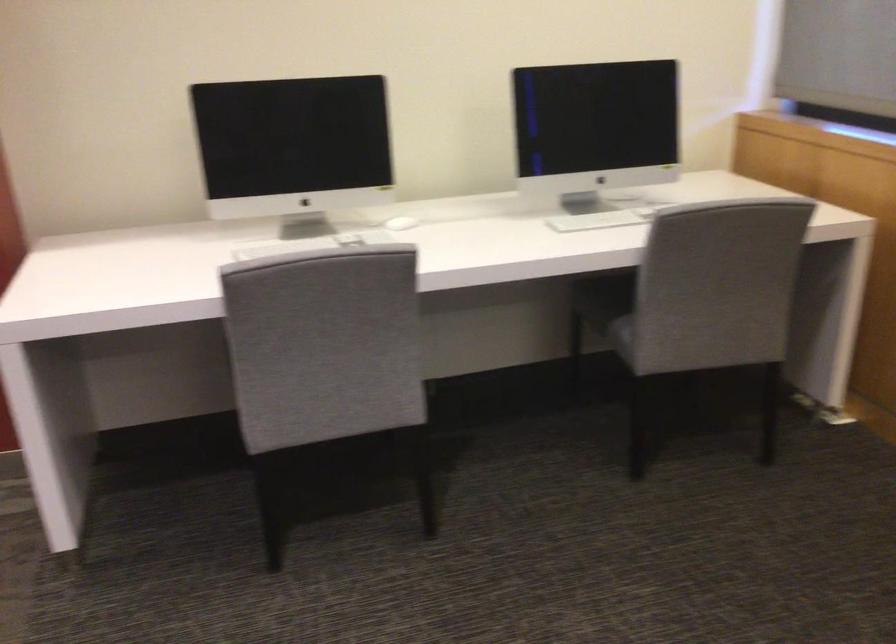
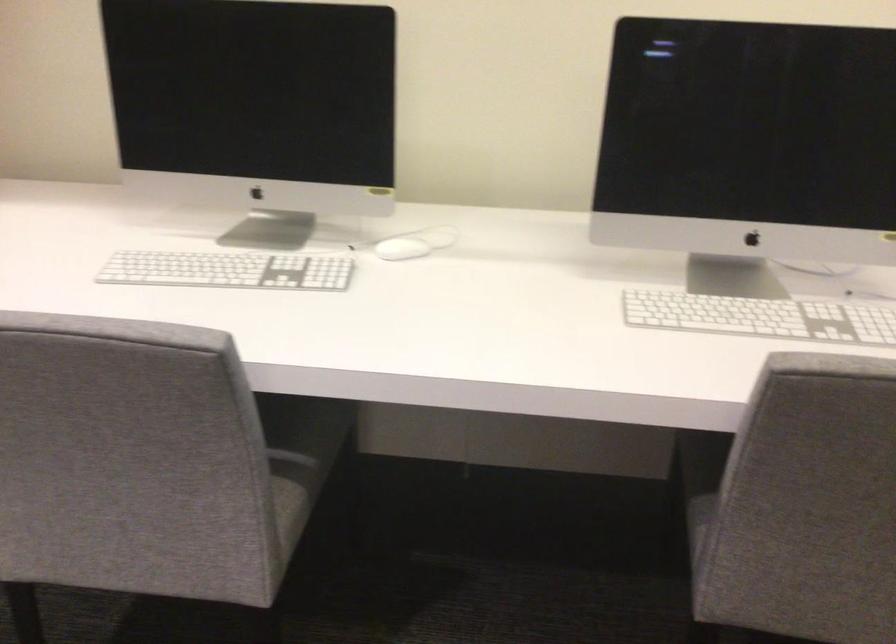
In the scene shown: Which direction would the cameraman need to move to produce the second image?

The cameraman walked toward right, forward.